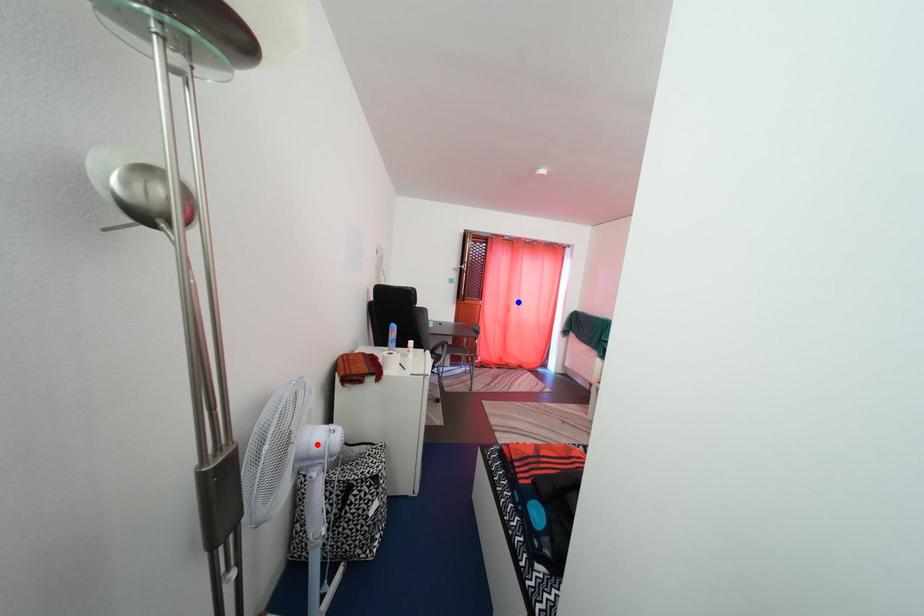
Question: Which of the two points in the image is closer to the camera?

Choices:
 (A) Blue point is closer.
 (B) Red point is closer.

Answer: (B)